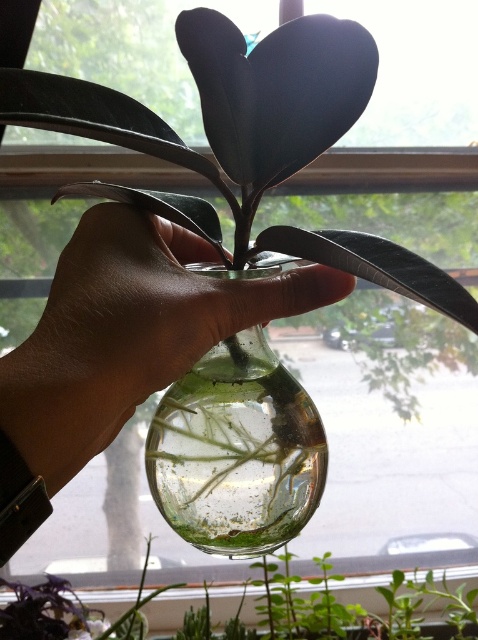
Does transparent glass vase at center appear on the right side of clear glass vase at center?

Indeed, transparent glass vase at center is positioned on the right side of clear glass vase at center.

Describe the element at coordinates (237, 451) in the screenshot. This screenshot has height=640, width=478. I see `transparent glass vase at center` at that location.

Is point (252, 408) behind point (341, 632)?

No, (252, 408) is closer to viewer.

You are a GUI agent. You are given a task and a screenshot of the screen. Output one action in this format:
    pyautogui.click(x=<x>, y=<y>)
    Task: Click on the transparent glass vase at center
    This screenshot has width=478, height=640.
    Given the screenshot: What is the action you would take?
    pyautogui.click(x=237, y=451)

How much distance is there between transparent glass hand at center and clear glass vase at center?

transparent glass hand at center and clear glass vase at center are 5.27 inches apart.

Can you confirm if transparent glass hand at center is positioned below clear glass vase at center?

No.

Image resolution: width=478 pixels, height=640 pixels. What do you see at coordinates (129, 332) in the screenshot?
I see `transparent glass hand at center` at bounding box center [129, 332].

At what (x,y) coordinates should I click in order to perform the action: click on transparent glass hand at center. Please return your answer as a coordinate pair (x, y). Looking at the image, I should click on [x=129, y=332].

Is transparent glass hand at center smaller than transparent glass vase at center?

Incorrect, transparent glass hand at center is not smaller in size than transparent glass vase at center.

Can you confirm if transparent glass hand at center is bigger than transparent glass vase at center?

Yes.

Who is more distant from viewer, (162, 316) or (208, 492)?

Positioned behind is point (208, 492).

Where is `transparent glass hand at center`? The height and width of the screenshot is (640, 478). transparent glass hand at center is located at coordinates click(129, 332).